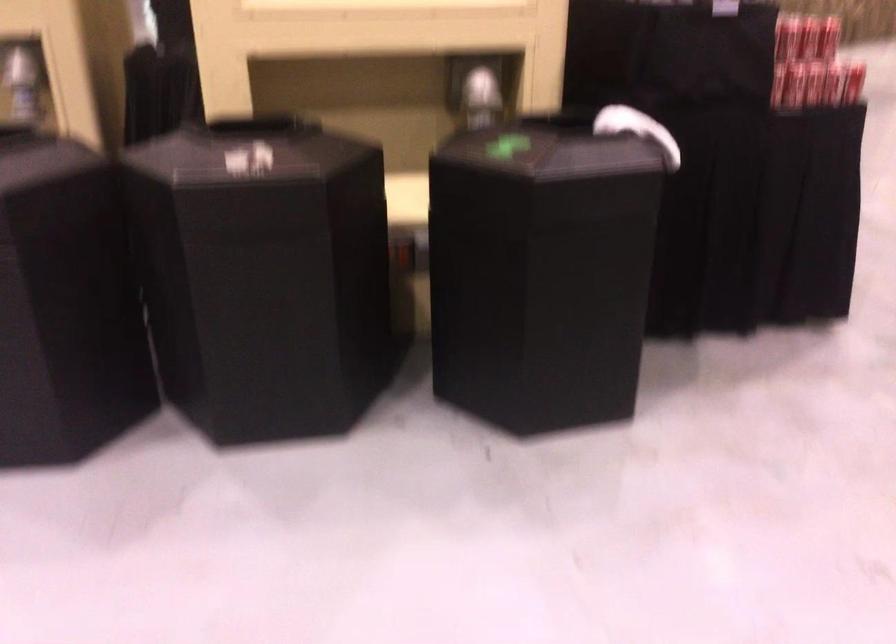
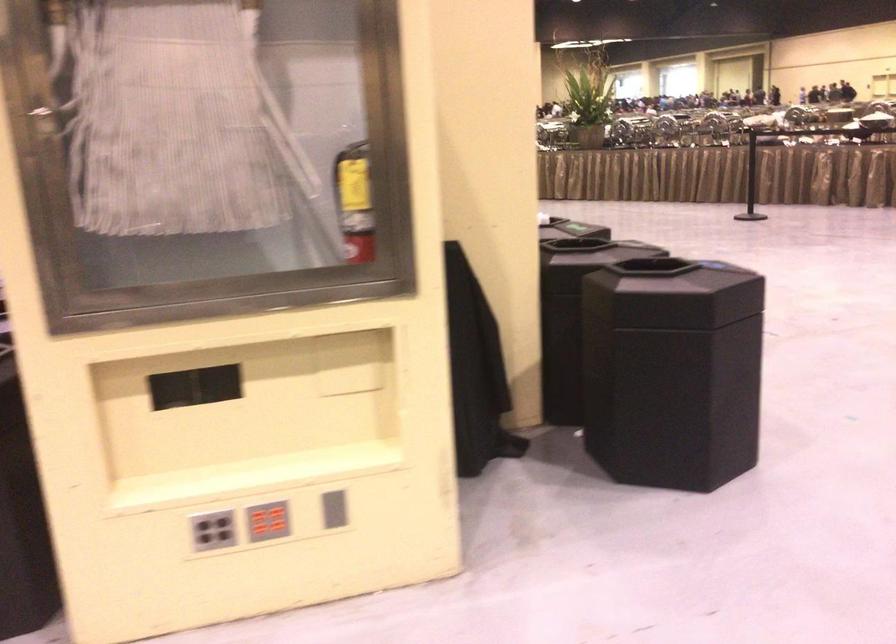
Question: I am providing you with two images of the same scene from different viewpoints. Please identify which objects are invisible in image2.

Choices:
 (A) red soda can
 (B) red button panel
 (C) husky plush toy
 (D) grey button panel

Answer: (A)